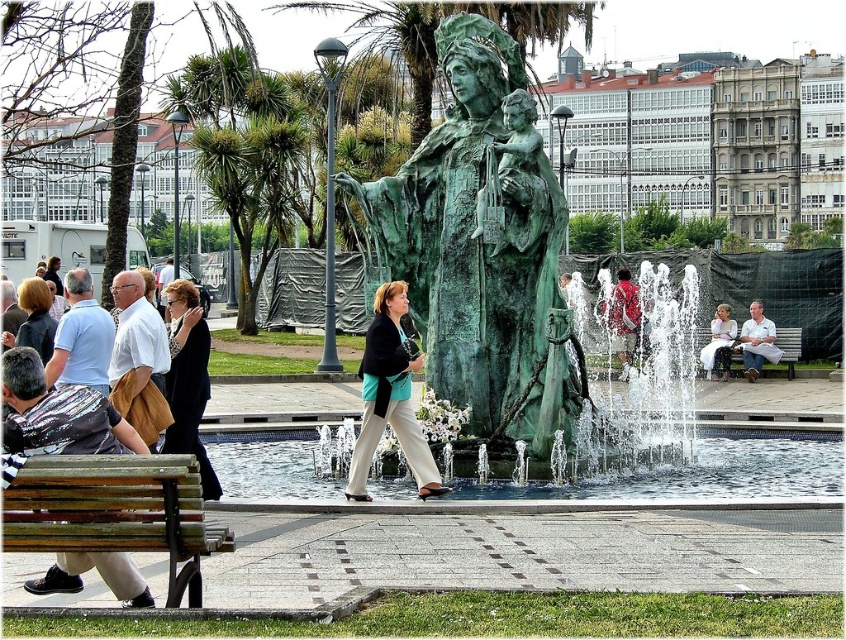
You are standing at the point with coordinates (696, 419). What object is located exactly at your current position?

The green patina fountain at center is located exactly at the point with coordinates (696, 419).

You are a photographer setting up a tripod to capture the green patina statue at center and the black fabric coat at left in the same frame. Which object should you focus on first if you want to ensure both are in sharp focus?

The green patina statue at center is smaller than the black fabric coat at left, so you should focus on the smaller object first to ensure depth of field covers both.

You are a photographer standing at the location of the black fabric coat at left. You want to take a photo of the green patina statue at center. What is the minimum distance you need to walk to get to the statue?

The green patina statue at center and black fabric coat at left are 9.60 meters apart from each other, so you need to walk at least 9.60 meters to reach the statue.